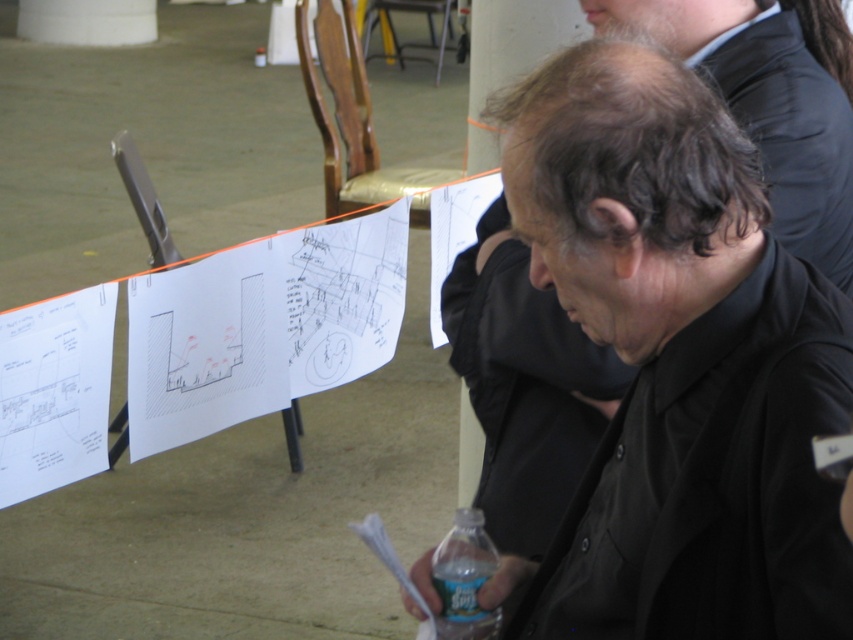
Question: Does black matte jacket at lower right appear on the left side of white paper at left?

Choices:
 (A) no
 (B) yes

Answer: (A)

Question: Which of the following is the closest to the observer?

Choices:
 (A) (561, 577)
 (B) (448, 632)

Answer: (A)

Question: Which of these objects is positioned closest to the black matte shirt at center?

Choices:
 (A) clear plastic bottle at lower center
 (B) black matte jacket at lower right
 (C) white paper at left

Answer: (B)

Question: Estimate the real-world distances between objects in this image. Which object is closer to the black matte jacket at lower right?

Choices:
 (A) white paper at left
 (B) clear plastic bottle at lower center

Answer: (B)

Question: Is black matte jacket at lower right to the left of clear plastic bottle at lower center from the viewer's perspective?

Choices:
 (A) yes
 (B) no

Answer: (B)

Question: Can you confirm if black matte jacket at lower right is thinner than clear plastic bottle at lower center?

Choices:
 (A) yes
 (B) no

Answer: (B)